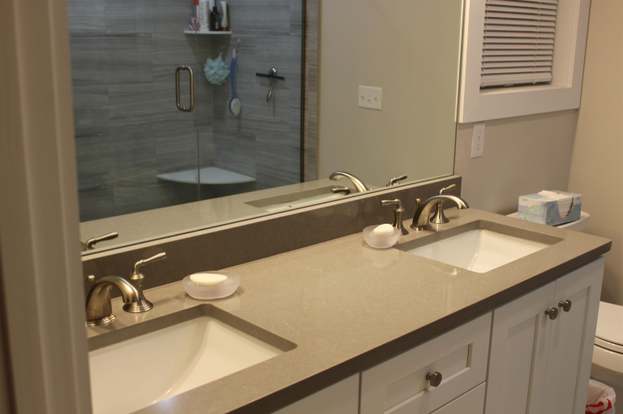
This screenshot has height=414, width=623. I want to click on left sink, so click(x=196, y=351).